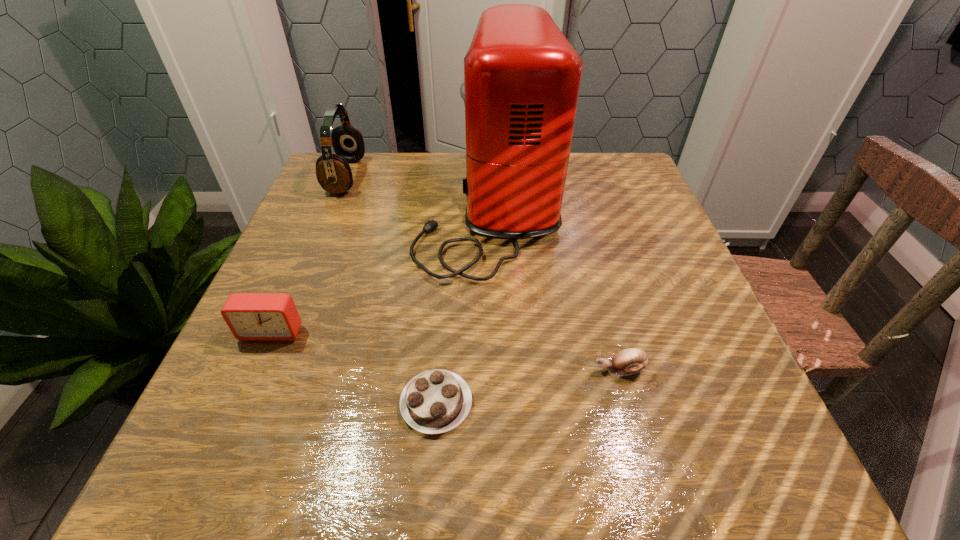
Find the location of a particular element. vacant space that satisfies the following two spatial constraints: 1. on the front-facing side of the kitchen mixer; 2. on the front-facing side of the third farthest object is located at coordinates (492, 332).

The width and height of the screenshot is (960, 540). I want to click on blank area in the image that satisfies the following two spatial constraints: 1. on the ear cups of the chocolate cake; 2. on the left side of the second tallest object, so click(252, 403).

Find the location of a particular element. This screenshot has width=960, height=540. vacant space that satisfies the following two spatial constraints: 1. on the ear cups of the fourth shortest object; 2. on the front-facing side of the third shortest object is located at coordinates (282, 332).

Find the location of a particular element. The height and width of the screenshot is (540, 960). vacant space that satisfies the following two spatial constraints: 1. on the front-facing side of the chocolate cake; 2. on the left side of the third nearest object is located at coordinates (241, 403).

I want to click on free space that satisfies the following two spatial constraints: 1. on the front-facing side of the shortest object; 2. on the left side of the alarm clock, so click(x=241, y=403).

You are a GUI agent. You are given a task and a screenshot of the screen. Output one action in this format:
    pyautogui.click(x=<x>, y=<y>)
    Task: Click on the vacant space that satisfies the following two spatial constraints: 1. on the front-facing side of the escargot; 2. on the front side of the shortest object
    
    Given the screenshot: What is the action you would take?
    628,403